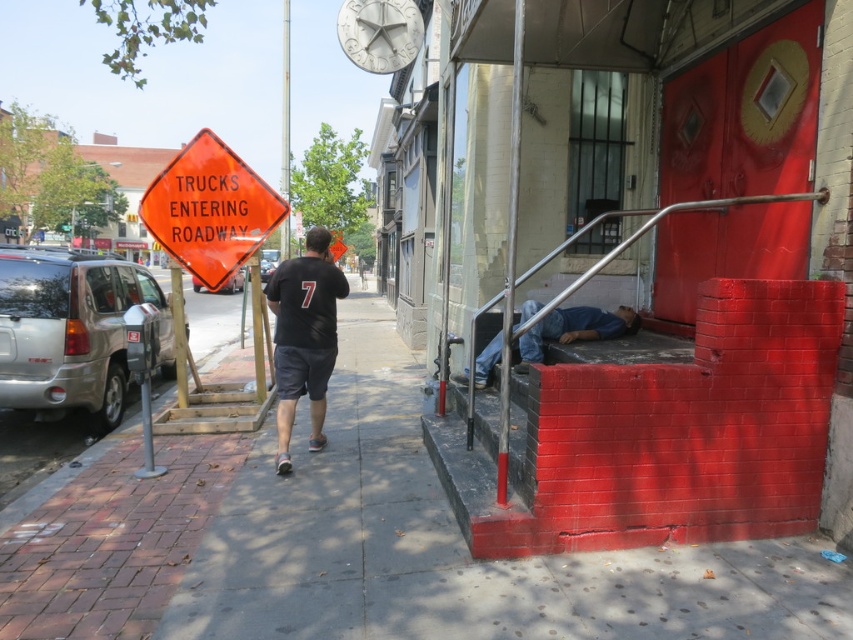
I want to click on black matte t-shirt at center, so click(305, 337).

Based on the photo, does black matte t-shirt at center appear on the left side of blue jeans at lower right?

Yes, black matte t-shirt at center is to the left of blue jeans at lower right.

Between point (326, 257) and point (630, 323), which one is positioned in front?

Positioned in front is point (326, 257).

You are a GUI agent. You are given a task and a screenshot of the screen. Output one action in this format:
    pyautogui.click(x=<x>, y=<y>)
    Task: Click on the black matte t-shirt at center
    
    Given the screenshot: What is the action you would take?
    pyautogui.click(x=305, y=337)

Is point (321, 289) positioned before point (646, 220)?

That is True.

Is black matte t-shirt at center further to the viewer compared to metal at right?

Yes, black matte t-shirt at center is further from the viewer.

Identify the location of black matte t-shirt at center. Image resolution: width=853 pixels, height=640 pixels. (305, 337).

Is black matte t-shirt at center to the right of white stone clock at upper center from the viewer's perspective?

No, black matte t-shirt at center is not to the right of white stone clock at upper center.

Who is higher up, black matte t-shirt at center or white stone clock at upper center?

white stone clock at upper center

Is point (323, 355) positioned before point (352, 4)?

Yes, point (323, 355) is in front of point (352, 4).

What are the coordinates of `black matte t-shirt at center` in the screenshot? It's located at (305, 337).